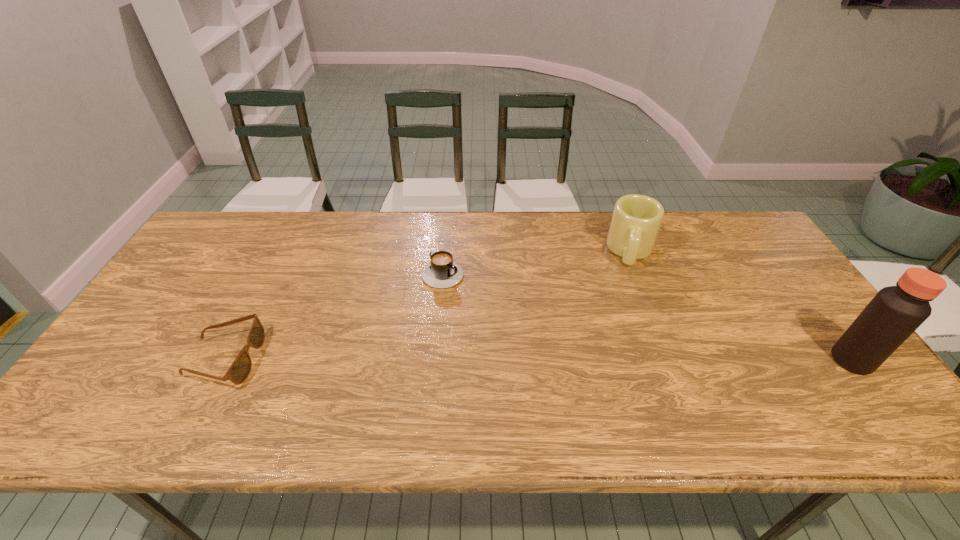
Where is `free space at the far edge`? The height and width of the screenshot is (540, 960). free space at the far edge is located at coordinates (529, 220).

Locate an element on the screen. vacant region at the near edge is located at coordinates (304, 370).

Find the location of a particular element. blank space at the left edge is located at coordinates (175, 352).

Identify the location of vacant area at the right edge. This screenshot has height=540, width=960. (769, 284).

Find the location of a particular element. The height and width of the screenshot is (540, 960). vacant space at the far left corner of the desktop is located at coordinates (228, 216).

Identify the location of vacant region at the far right corner of the desktop. (747, 229).

Locate an element on the screen. This screenshot has width=960, height=540. blank region between the third shortest object and the leftmost object is located at coordinates (428, 305).

Where is `unoccupied position between the second object from left to right and the leftmost object`? This screenshot has height=540, width=960. unoccupied position between the second object from left to right and the leftmost object is located at coordinates (334, 314).

Where is `empty location between the second object from right to left and the second object from left to right`? The image size is (960, 540). empty location between the second object from right to left and the second object from left to right is located at coordinates (538, 261).

Where is `free space between the rightmost object and the third shortest object`? The width and height of the screenshot is (960, 540). free space between the rightmost object and the third shortest object is located at coordinates (742, 306).